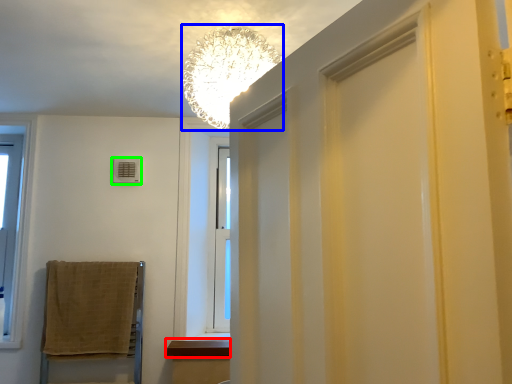
Question: Considering the real-world distances, which object is closest to window sill (highlighted by a red box)? lamp (highlighted by a blue box) or air conditioner (highlighted by a green box).

Choices:
 (A) lamp
 (B) air conditioner

Answer: (B)